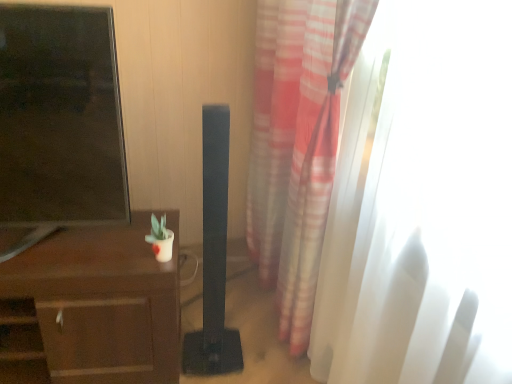
Find the location of a particular element. black matte speaker at center is located at coordinates (214, 256).

This screenshot has height=384, width=512. What are the coordinates of `matte black tv at left` in the screenshot? It's located at tap(59, 121).

Is brown wood desk at left at the back of black matte speaker at center?

No, black matte speaker at center is not facing the opposite direction of brown wood desk at left.

Looking at this image, considering the sizes of objects black matte speaker at center and brown wood desk at left in the image provided, who is smaller, black matte speaker at center or brown wood desk at left?

black matte speaker at center is smaller.

Does black matte speaker at center come behind brown wood desk at left?

That is False.

From the image's perspective, which is above, black matte speaker at center or brown wood desk at left?

black matte speaker at center appears higher in the image.

Is black matte speaker at center oriented away from matte black tv at left?

black matte speaker at center does not have its back to matte black tv at left.

Can you tell me how much black matte speaker at center and matte black tv at left differ in facing direction?

1.86 degrees.

Looking at their sizes, would you say black matte speaker at center is wider or thinner than matte black tv at left?

In the image, black matte speaker at center appears to be more narrow than matte black tv at left.

In the scene shown: How distant is black matte speaker at center from matte black tv at left?

black matte speaker at center and matte black tv at left are 19.06 inches apart from each other.

Does point (366, 196) appear closer or farther from the camera than point (83, 168)?

Point (366, 196) is positioned closer to the camera compared to point (83, 168).

Is translucent white curtain at right in front of matte black tv at left?

Yes.

Locate an element on the screen. The height and width of the screenshot is (384, 512). window in front of the matte black tv at left is located at coordinates (422, 203).

Which of these two, translucent white curtain at right or matte black tv at left, stands shorter?

Standing shorter between the two is matte black tv at left.

This screenshot has height=384, width=512. What are the coordinates of `desk that is below the matte black tv at left (from the image's perspective)` in the screenshot? It's located at (91, 308).

Between brown wood desk at left and matte black tv at left, which one has larger size?

With larger size is brown wood desk at left.

In terms of width, does brown wood desk at left look wider or thinner when compared to matte black tv at left?

In the image, brown wood desk at left appears to be wider than matte black tv at left.

Which is more to the right, brown wood desk at left or matte black tv at left?

From the viewer's perspective, matte black tv at left appears more on the right side.

What's the angular difference between matte black tv at left and translucent white curtain at right's facing directions?

The angle between the facing direction of matte black tv at left and the facing direction of translucent white curtain at right is 80.6 degrees.

Between point (101, 52) and point (352, 249), which one is positioned behind?

Point (352, 249)

Are matte black tv at left and translucent white curtain at right beside each other?

matte black tv at left and translucent white curtain at right are clearly separated.

Which of these two, matte black tv at left or translucent white curtain at right, is smaller?

matte black tv at left.

How far apart are brown wood desk at left and translucent white curtain at right?

brown wood desk at left is 85.55 centimeters away from translucent white curtain at right.

Can we say brown wood desk at left lies outside translucent white curtain at right?

Yes.

Looking at this image, considering the relative positions of brown wood desk at left and translucent white curtain at right in the image provided, is brown wood desk at left to the left or to the right of translucent white curtain at right?

In the image, brown wood desk at left appears on the left side of translucent white curtain at right.

Between point (75, 238) and point (468, 319), which one is positioned in front?

Point (468, 319)

Which of these two, black matte speaker at center or translucent white curtain at right, stands taller?

Standing taller between the two is translucent white curtain at right.

Could you tell me if black matte speaker at center is facing translucent white curtain at right?

No, black matte speaker at center is not oriented towards translucent white curtain at right.

How many degrees apart are the facing directions of black matte speaker at center and translucent white curtain at right?

The facing directions of black matte speaker at center and translucent white curtain at right are 82.4 degrees apart.

Is black matte speaker at center positioned behind translucent white curtain at right?

Yes, it is behind translucent white curtain at right.

Find the location of a particular element. The width and height of the screenshot is (512, 384). speaker above the brown wood desk at left (from the image's perspective) is located at coordinates (214, 256).

Identify the location of speaker below the matte black tv at left (from the image's perspective). This screenshot has height=384, width=512. (214, 256).

Estimate the real-world distances between objects in this image. Which object is further from translucent white curtain at right, matte black tv at left or black matte speaker at center?

Among the two, matte black tv at left is located further to translucent white curtain at right.

Based on their spatial positions, is translucent white curtain at right or matte black tv at left closer to black matte speaker at center?

matte black tv at left lies closer to black matte speaker at center than the other object.

Estimate the real-world distances between objects in this image. Which object is further from brown wood desk at left, matte black tv at left or translucent white curtain at right?

Among the two, translucent white curtain at right is located further to brown wood desk at left.

Looking at the image, which one is located further to black matte speaker at center, brown wood desk at left or translucent white curtain at right?

The object further to black matte speaker at center is translucent white curtain at right.

Based on their spatial positions, is translucent white curtain at right or black matte speaker at center closer to brown wood desk at left?

black matte speaker at center is closer to brown wood desk at left.

Based on their spatial positions, is translucent white curtain at right or black matte speaker at center further from matte black tv at left?

The object further to matte black tv at left is translucent white curtain at right.

When comparing their distances from black matte speaker at center, does matte black tv at left or translucent white curtain at right seem closer?

Among the two, matte black tv at left is located nearer to black matte speaker at center.

In the scene shown: Considering their positions, is brown wood desk at left positioned closer to matte black tv at left than black matte speaker at center?

brown wood desk at left is positioned closer to the anchor matte black tv at left.

The image size is (512, 384). I want to click on tv show between brown wood desk at left and translucent white curtain at right in the horizontal direction, so click(x=59, y=121).

I want to click on tv show located between brown wood desk at left and black matte speaker at center in the left-right direction, so click(x=59, y=121).

Image resolution: width=512 pixels, height=384 pixels. What are the coordinates of `speaker between brown wood desk at left and translucent white curtain at right in the horizontal direction` in the screenshot? It's located at (214, 256).

This screenshot has height=384, width=512. What are the coordinates of `speaker between matte black tv at left and translucent white curtain at right in the horizontal direction` in the screenshot? It's located at (214, 256).